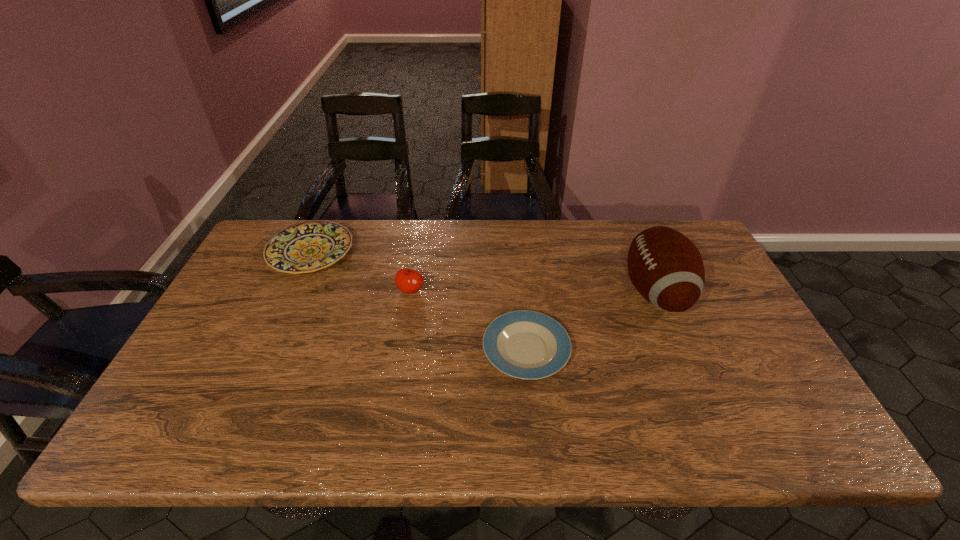
You are a GUI agent. You are given a task and a screenshot of the screen. Output one action in this format:
    pyautogui.click(x=<x>, y=<y>)
    Task: Click on the free space in the image that satisfies the following two spatial constraints: 1. on the front side of the left plate; 2. on the left side of the third object from right to left
    The image size is (960, 540).
    Given the screenshot: What is the action you would take?
    pyautogui.click(x=294, y=290)

Locate an element on the screen. free point that satisfies the following two spatial constraints: 1. on the front side of the second tallest object; 2. on the left side of the farther plate is located at coordinates (294, 290).